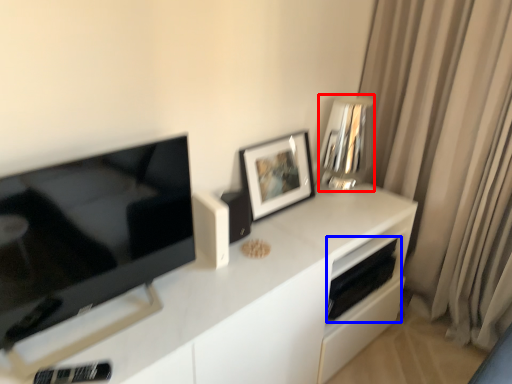
Question: Which of the following is the farthest to the observer, appliance (highlighted by a red box) or appliance (highlighted by a blue box)?

Choices:
 (A) appliance
 (B) appliance

Answer: (B)